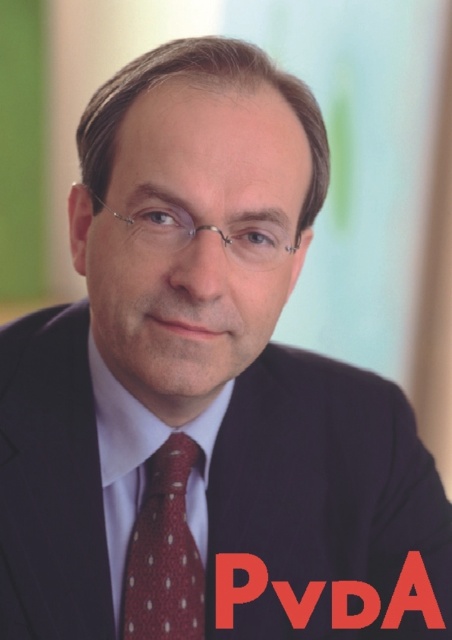
Question: Is red dotted tie at center further to the viewer compared to white smooth dress shirt at center?

Choices:
 (A) yes
 (B) no

Answer: (A)

Question: Observing the image, what is the correct spatial positioning of red dotted tie at center in reference to white smooth dress shirt at center?

Choices:
 (A) left
 (B) right

Answer: (B)

Question: Which object appears farthest from the camera in this image?

Choices:
 (A) red dotted tie at center
 (B) white smooth dress shirt at center

Answer: (A)

Question: Which of the following is the farthest from the observer?

Choices:
 (A) (98, 426)
 (B) (158, 451)

Answer: (A)

Question: Does red dotted tie at center appear over white smooth dress shirt at center?

Choices:
 (A) no
 (B) yes

Answer: (A)